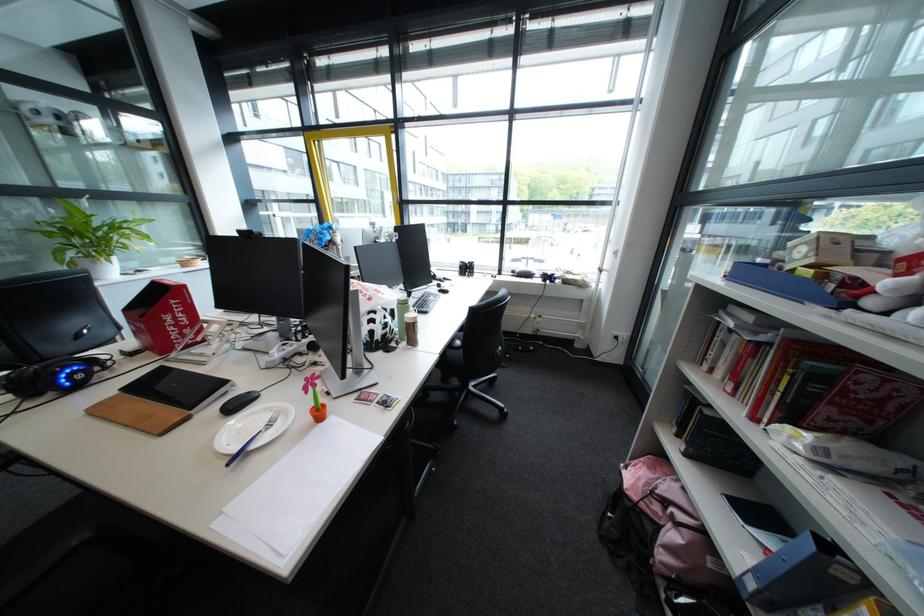
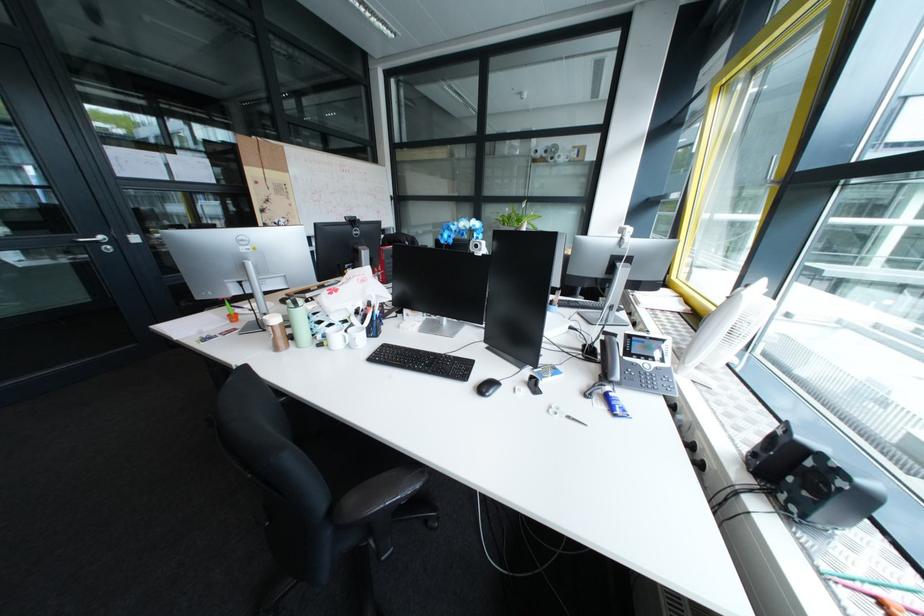
Locate, in the second image, the point that corresponds to pixel 482 265 in the first image.

(823, 464)